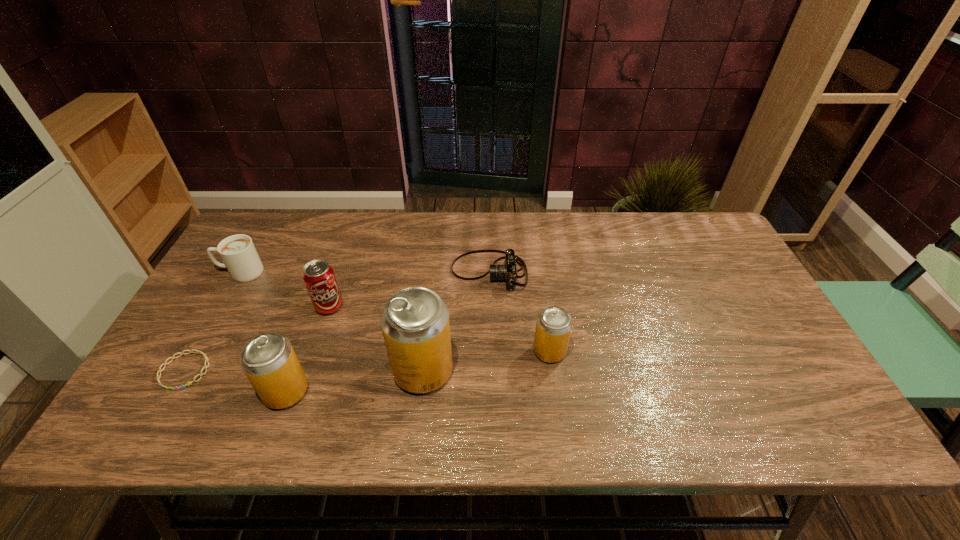
Locate an element on the screen. free point located 0.370m on the front-facing side of the second shortest object is located at coordinates (328, 272).

What are the coordinates of `vacant region located on the front-facing side of the second shortest object` in the screenshot? It's located at [x=415, y=272].

Locate an element on the screen. The width and height of the screenshot is (960, 540). vacant space located on the front of the farthest soda is located at coordinates (299, 400).

Find the location of a particular element. The image size is (960, 540). object that is positioned at the far edge is located at coordinates (507, 272).

The image size is (960, 540). I want to click on bracelet situated at the near edge, so click(x=190, y=351).

The width and height of the screenshot is (960, 540). What are the coordinates of `cappuccino at the left edge` in the screenshot? It's located at (238, 252).

Find the location of a particular element. bracelet positioned at the left edge is located at coordinates (190, 351).

At what (x,y) coordinates should I click in order to perform the action: click on object that is at the near left corner. Please return your answer as a coordinate pair (x, y). The height and width of the screenshot is (540, 960). Looking at the image, I should click on (190, 351).

Find the location of a particular element. This screenshot has width=960, height=540. free space at the far edge of the desktop is located at coordinates (473, 240).

At what (x,y) coordinates should I click in order to perform the action: click on vacant space at the left edge of the desktop. Please return your answer as a coordinate pair (x, y). The width and height of the screenshot is (960, 540). Looking at the image, I should click on (250, 285).